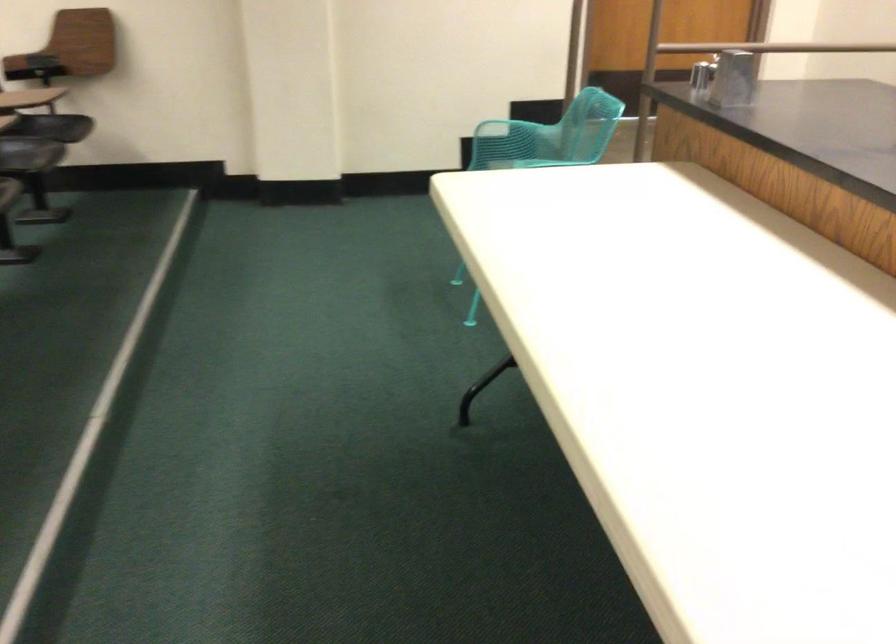
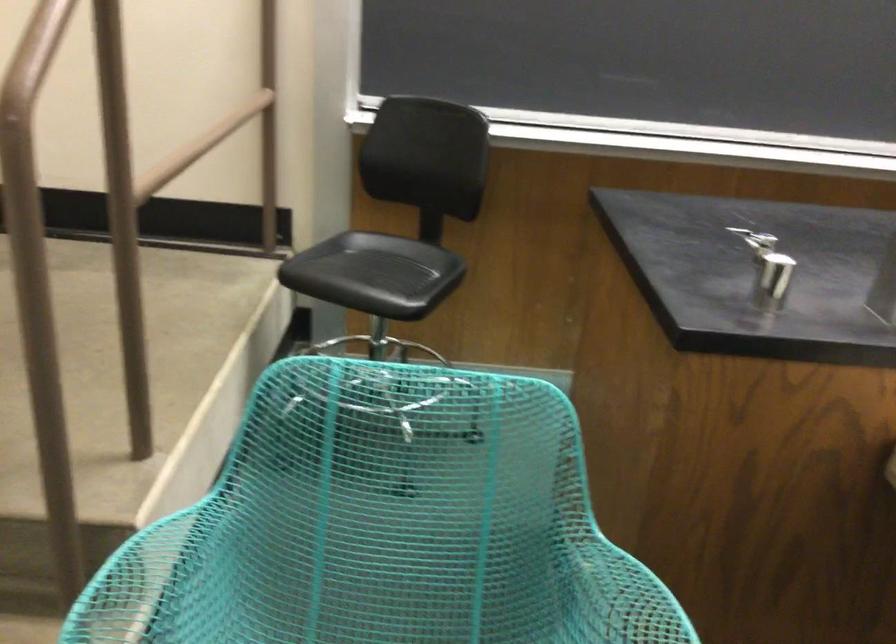
Locate, in the second image, the point that corresponds to (x=507, y=129) in the first image.

(150, 582)